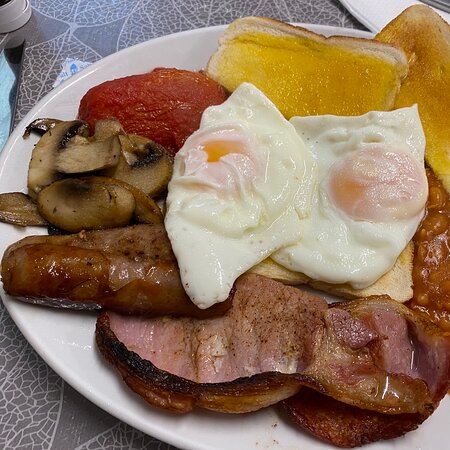
You are a GUI agent. You are given a task and a screenshot of the screen. Output one action in this format:
    pyautogui.click(x=<x>, y=<y>)
    Task: Click on the white plate
    
    Given the screenshot: What is the action you would take?
    pyautogui.click(x=231, y=443)